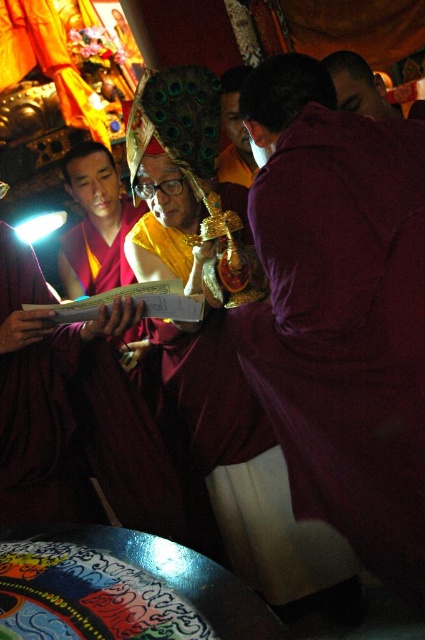
Question: Which object appears closest to the camera in this image?

Choices:
 (A) maroon robe at center
 (B) purple velvet robe at center
 (C) maroon robe at upper right

Answer: (B)

Question: Does maroon robe at center appear over maroon robe at upper right?

Choices:
 (A) no
 (B) yes

Answer: (A)

Question: Which point appears farthest from the camera in this image?

Choices:
 (A) (380, 109)
 (B) (221, 154)
 (C) (87, 186)

Answer: (B)

Question: From the image, what is the correct spatial relationship of purple velvet robe at center in relation to maroon robe at upper right?

Choices:
 (A) right
 (B) left

Answer: (B)

Question: Which of the following is the farthest from the observer?

Choices:
 (A) maroon robe at upper right
 (B) matte gold mask at center
 (C) purple velvet robe at center

Answer: (B)

Question: Can you confirm if purple velvet robe at center is bigger than maroon robe at center?

Choices:
 (A) yes
 (B) no

Answer: (A)